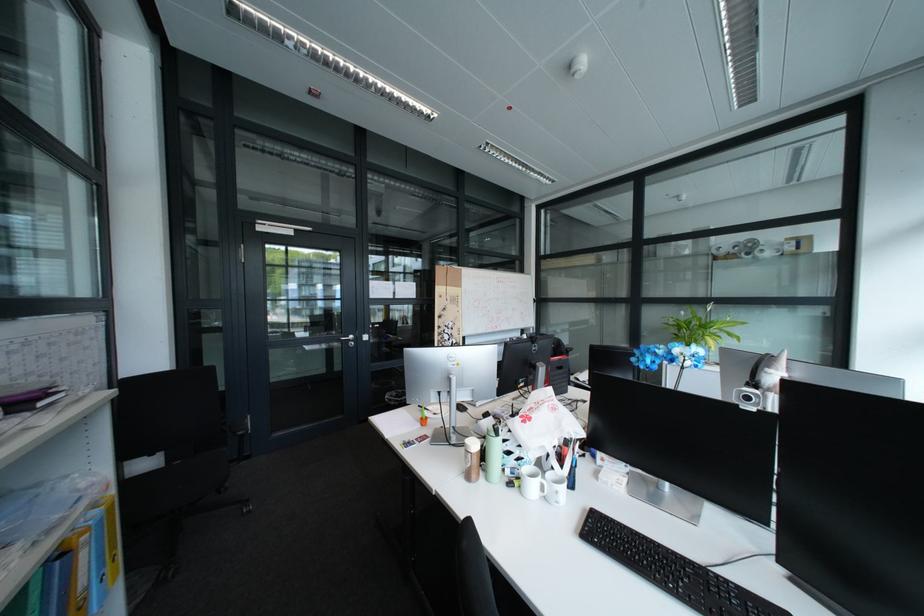
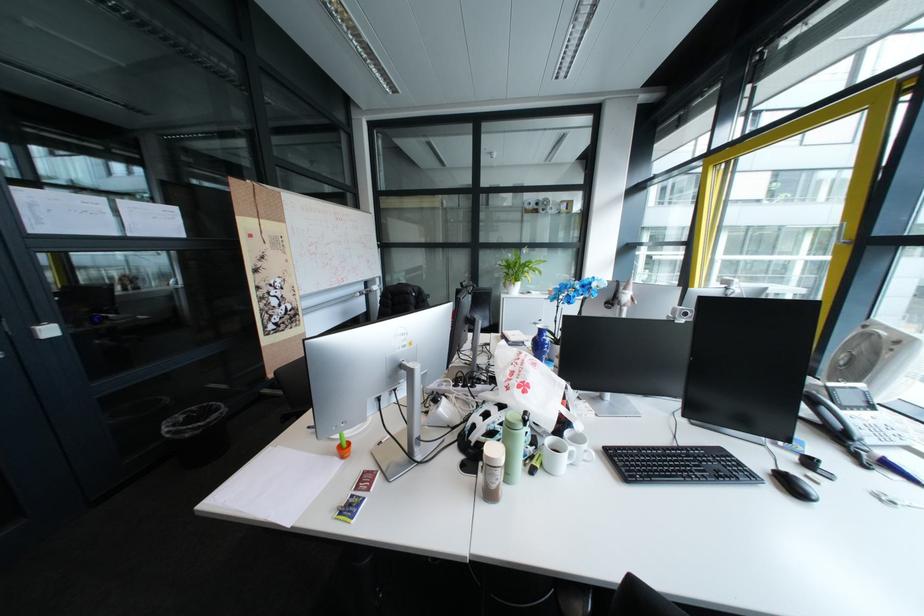
In the second image, find the point that corresponds to (742,582) in the first image.

(710, 448)